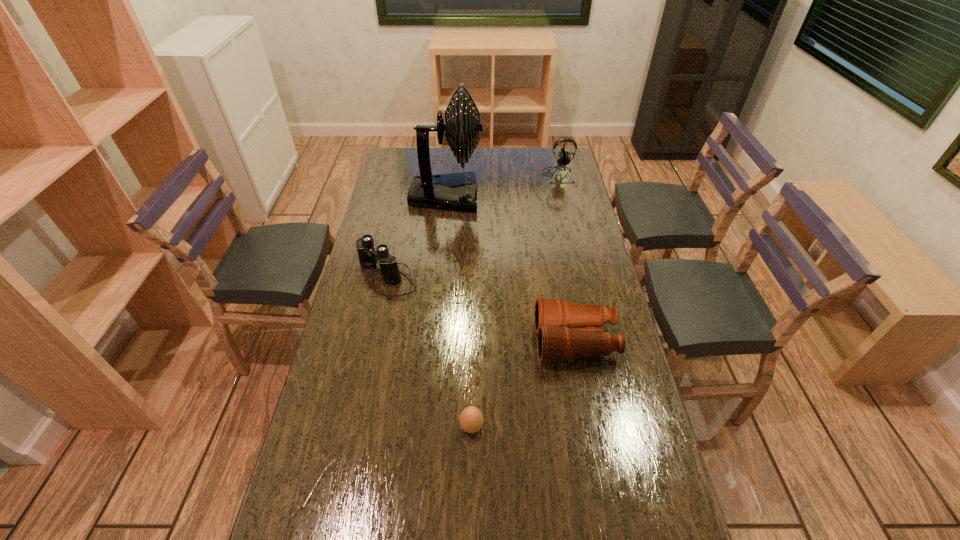
Locate an element on the screen. This screenshot has width=960, height=540. object that is at the far right corner is located at coordinates (563, 157).

You are a GUI agent. You are given a task and a screenshot of the screen. Output one action in this format:
    pyautogui.click(x=<x>, y=<y>)
    Task: Click on the free space at the far edge of the desktop
    This screenshot has width=960, height=540.
    Given the screenshot: What is the action you would take?
    pyautogui.click(x=484, y=151)

I want to click on vacant space at the left edge of the desktop, so click(374, 282).

Where is `free region at the right edge of the desktop`? free region at the right edge of the desktop is located at coordinates (637, 530).

In the image, there is a desktop. At what (x,y) coordinates should I click in order to perform the action: click on vacant space at the far right corner. Please return your answer as a coordinate pair (x, y). The height and width of the screenshot is (540, 960). Looking at the image, I should click on (561, 150).

Where is `free area in between the nearer binoculars and the nearest object`? The image size is (960, 540). free area in between the nearer binoculars and the nearest object is located at coordinates (523, 384).

Locate an element on the screen. The image size is (960, 540). blank region between the earphone and the fan is located at coordinates point(502,185).

Locate an element on the screen. The image size is (960, 540). free space between the earphone and the fan is located at coordinates (502, 185).

What are the coordinates of `free space between the boiled egg and the earphone` in the screenshot? It's located at (515, 301).

Find the location of a particular element. The height and width of the screenshot is (540, 960). vacant space in between the shortest object and the farther binoculars is located at coordinates (429, 352).